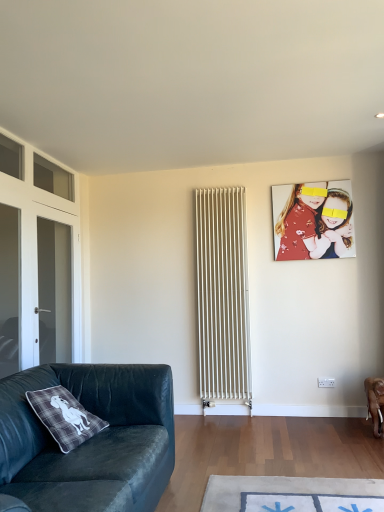
Identify the location of unoccupied area in front of white metal radiator at center. The image size is (384, 512). (229, 426).